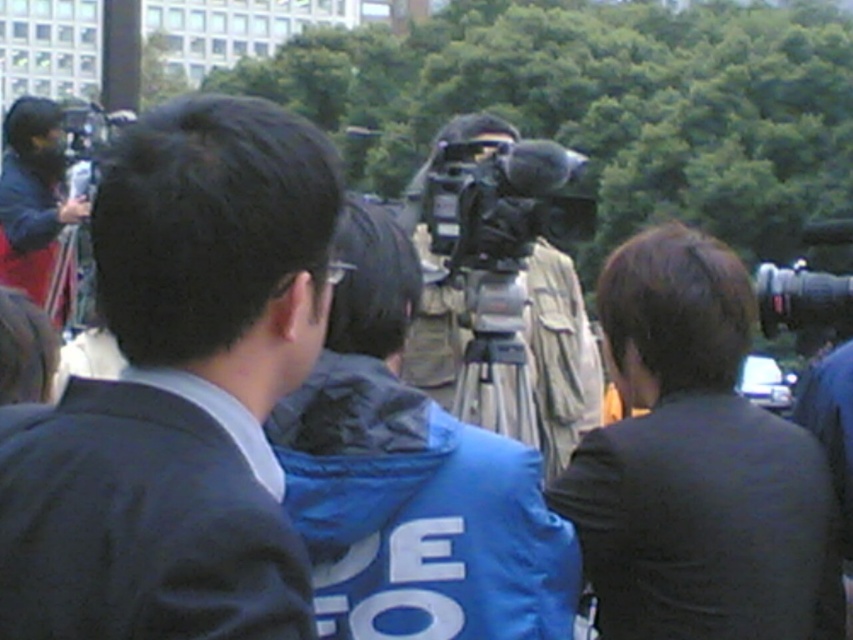
You are attending a press conference and need to position yourself to capture a clear shot. You have a camera bag with you and see the black matte suit at left and the silver metallic tripod at center. Which object is nearer to you so you can place your camera bag between them?

The black matte suit at left is closer to the viewer than the silver metallic tripod at center, so you should place your camera bag between the black matte suit at left and the silver metallic tripod at center.